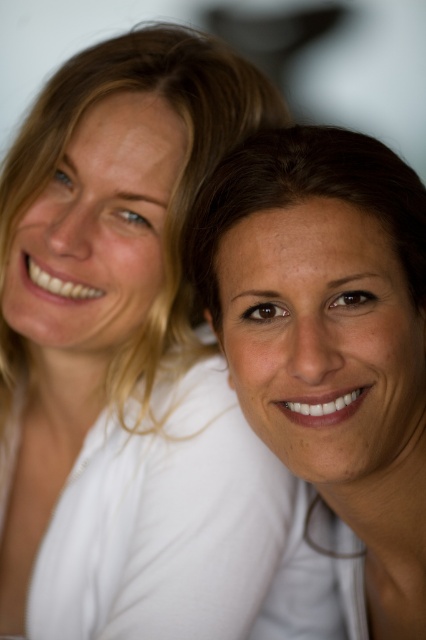
You are taking a photo of two people standing in front of you. You notice two points in the image at coordinates point (120, 275) and point (420, 490). Which point is closer to your camera?

Point (120, 275) is further to the camera than point (420, 490). Therefore, point (420, 490) is closer to the camera.

You need to place a 8 inch wide ribbon between the matte white shirt at upper left and the smooth skin face at center. Is there enough space?

The distance between the matte white shirt at upper left and the smooth skin face at center is 7.85 inches, which is slightly less than the 8 inch wide ribbon. Therefore, the ribbon will not fit between them.